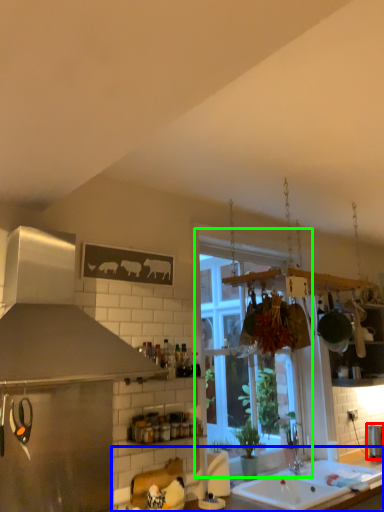
Question: Estimate the real-world distances between objects in this image. Which object is closer to appliance (highlighted by a red box), countertop (highlighted by a blue box) or window (highlighted by a green box)?

Choices:
 (A) countertop
 (B) window

Answer: (A)